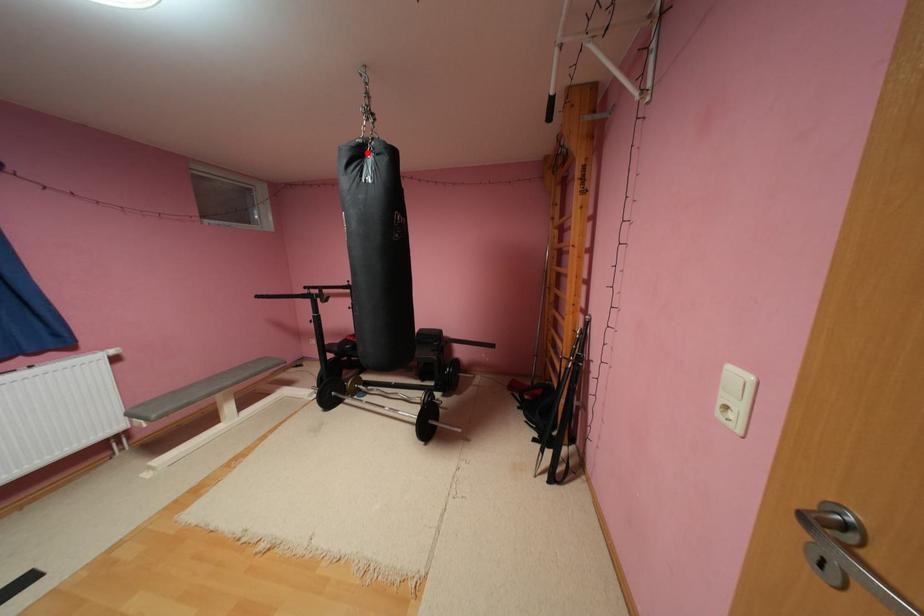
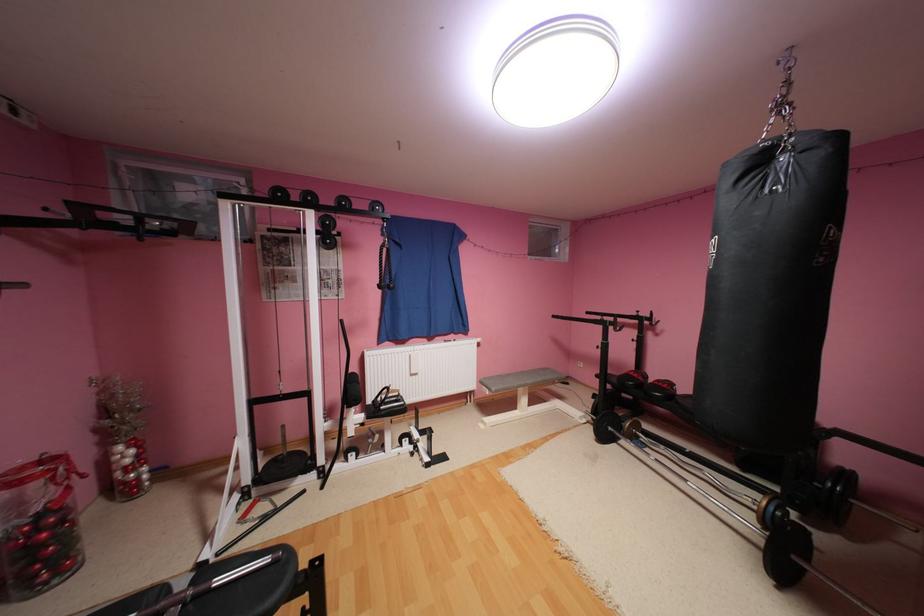
Where in the second image is the point corresponding to the highlighted location from the first image?

(769, 161)